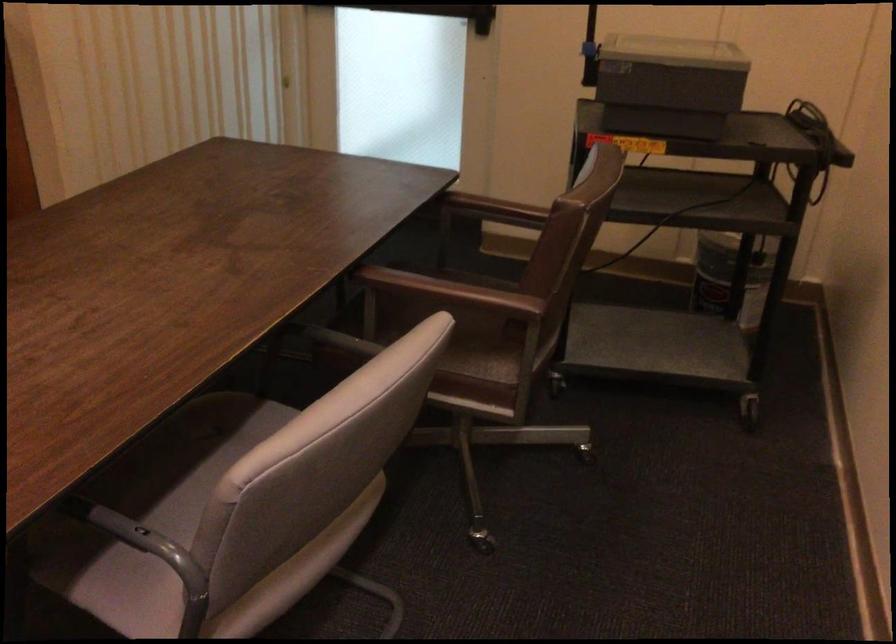
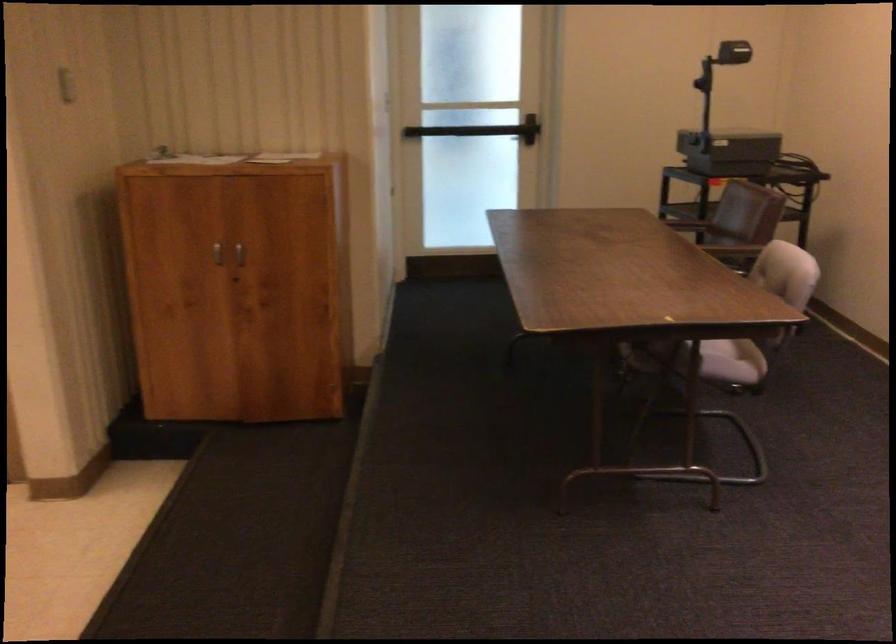
Question: I am providing you with two images of the same scene from different viewpoints. Please identify which objects are invisible in image2.

Choices:
 (A) light wood chair sitting surface
 (B) door push bar
 (C) projector head
 (D) gray chair sitting surface

Answer: (B)